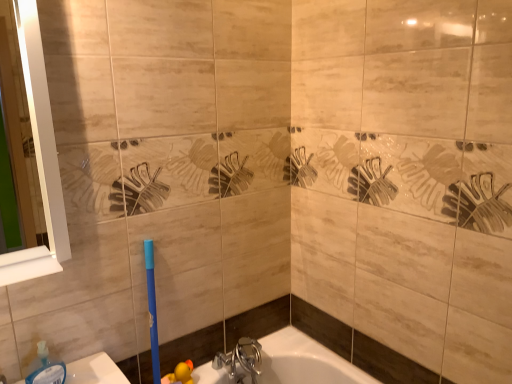
You are a GUI agent. You are given a task and a screenshot of the screen. Output one action in this format:
    pyautogui.click(x=<x>, y=<y>)
    Task: Click on the chrome metallic faucet at lower center
    
    Given the screenshot: What is the action you would take?
    pyautogui.click(x=241, y=360)

Does translucent plastic soap dispenser at lower left have a greater width compared to chrome metallic faucet at lower center?

No, translucent plastic soap dispenser at lower left is not wider than chrome metallic faucet at lower center.

Are translucent plastic soap dispenser at lower left and chrome metallic faucet at lower center far apart?

No, there isn't a large distance between translucent plastic soap dispenser at lower left and chrome metallic faucet at lower center.

From a real-world perspective, which object rests below the other?

From a 3D spatial view, chrome metallic faucet at lower center is below.

Does translucent plastic soap dispenser at lower left have a larger size compared to chrome metallic faucet at lower center?

Incorrect, translucent plastic soap dispenser at lower left is not larger than chrome metallic faucet at lower center.

Considering the positions of point (38, 366) and point (42, 266), is point (38, 366) closer or farther from the camera than point (42, 266)?

Point (38, 366) is positioned farther from the camera compared to point (42, 266).

Based on the photo, how far apart are translucent plastic soap dispenser at lower left and white glossy mirror at left?

translucent plastic soap dispenser at lower left and white glossy mirror at left are 18.73 inches apart from each other.

Is translucent plastic soap dispenser at lower left turned away from white glossy mirror at left?

translucent plastic soap dispenser at lower left is not turned away from white glossy mirror at left.

Is translucent plastic soap dispenser at lower left in contact with white glossy mirror at left?

No, translucent plastic soap dispenser at lower left is not making contact with white glossy mirror at left.

Is white glossy mirror at left smaller than chrome metallic faucet at lower center?

Actually, white glossy mirror at left might be larger than chrome metallic faucet at lower center.

From a real-world perspective, which object stands above the other?

white glossy mirror at left is physically above.

Is white glossy mirror at left thinner than chrome metallic faucet at lower center?

Indeed, white glossy mirror at left has a lesser width compared to chrome metallic faucet at lower center.

From the image's perspective, which one is positioned lower, chrome metallic faucet at lower center or white glossy mirror at left?

chrome metallic faucet at lower center, from the image's perspective.

Considering the relative sizes of chrome metallic faucet at lower center and white glossy mirror at left in the image provided, is chrome metallic faucet at lower center wider than white glossy mirror at left?

Correct, the width of chrome metallic faucet at lower center exceeds that of white glossy mirror at left.

Can you confirm if chrome metallic faucet at lower center is bigger than white glossy mirror at left?

No.

Who is more distant, chrome metallic faucet at lower center or white glossy mirror at left?

chrome metallic faucet at lower center is further from the camera.

Considering the relative sizes of chrome metallic faucet at lower center and translucent plastic soap dispenser at lower left in the image provided, is chrome metallic faucet at lower center thinner than translucent plastic soap dispenser at lower left?

No.

In the scene shown: From a real-world perspective, is chrome metallic faucet at lower center under translucent plastic soap dispenser at lower left?

Yes, from a real-world perspective, chrome metallic faucet at lower center is below translucent plastic soap dispenser at lower left.

Is chrome metallic faucet at lower center shorter than translucent plastic soap dispenser at lower left?

In fact, chrome metallic faucet at lower center may be taller than translucent plastic soap dispenser at lower left.

Is white glossy mirror at left next to translucent plastic soap dispenser at lower left and touching it?

white glossy mirror at left is not next to translucent plastic soap dispenser at lower left, and they're not touching.

From the image's perspective, is white glossy mirror at left on top of translucent plastic soap dispenser at lower left?

Yes, from the image's perspective, white glossy mirror at left is above translucent plastic soap dispenser at lower left.

Between white glossy mirror at left and translucent plastic soap dispenser at lower left, which one has larger size?

white glossy mirror at left.

Is white glossy mirror at left positioned with its back to translucent plastic soap dispenser at lower left?

That's not correct — white glossy mirror at left is not looking away from translucent plastic soap dispenser at lower left.

This screenshot has height=384, width=512. I want to click on tap on the right of the translucent plastic soap dispenser at lower left, so click(241, 360).

At what (x,y) coordinates should I click in order to perform the action: click on soap dispenser located behind the white glossy mirror at left. Please return your answer as a coordinate pair (x, y). The image size is (512, 384). Looking at the image, I should click on coord(45,368).

Considering their positions, is translucent plastic soap dispenser at lower left positioned closer to chrome metallic faucet at lower center than white glossy mirror at left?

translucent plastic soap dispenser at lower left is closer to chrome metallic faucet at lower center.

Considering their positions, is white glossy mirror at left positioned further to translucent plastic soap dispenser at lower left than chrome metallic faucet at lower center?

The object further to translucent plastic soap dispenser at lower left is chrome metallic faucet at lower center.

Based on their spatial positions, is translucent plastic soap dispenser at lower left or chrome metallic faucet at lower center further from white glossy mirror at left?

chrome metallic faucet at lower center is further to white glossy mirror at left.

Looking at this image, looking at the image, which one is located further to translucent plastic soap dispenser at lower left, chrome metallic faucet at lower center or white glossy mirror at left?

Among the two, chrome metallic faucet at lower center is located further to translucent plastic soap dispenser at lower left.

Based on their spatial positions, is chrome metallic faucet at lower center or translucent plastic soap dispenser at lower left closer to white glossy mirror at left?

translucent plastic soap dispenser at lower left is closer to white glossy mirror at left.

Estimate the real-world distances between objects in this image. Which object is further from chrome metallic faucet at lower center, white glossy mirror at left or translucent plastic soap dispenser at lower left?

Based on the image, white glossy mirror at left appears to be further to chrome metallic faucet at lower center.

Find the location of a particular element. The image size is (512, 384). soap dispenser between white glossy mirror at left and chrome metallic faucet at lower center in the vertical direction is located at coordinates (45, 368).